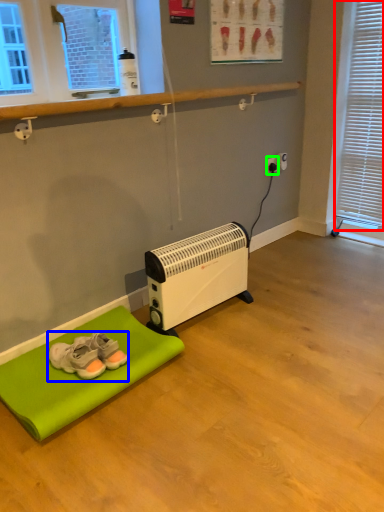
Question: Considering the real-world distances, which object is closest to blind (highlighted by a red box)? footwear (highlighted by a blue box) or electric outlet (highlighted by a green box).

Choices:
 (A) footwear
 (B) electric outlet

Answer: (B)